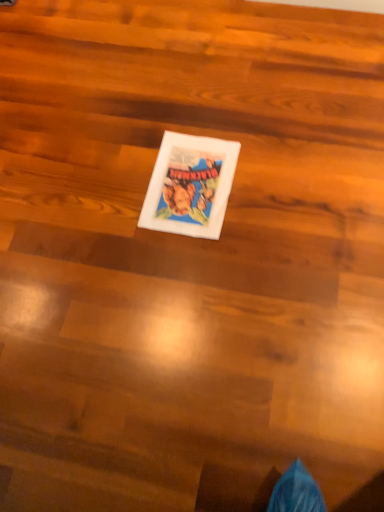
Describe the element at coordinates (190, 185) in the screenshot. I see `white matte comic book at center` at that location.

At what (x,y) coordinates should I click in order to perform the action: click on white matte comic book at center. Please return your answer as a coordinate pair (x, y). This screenshot has height=512, width=384. Looking at the image, I should click on (x=190, y=185).

In order to click on white matte comic book at center in this screenshot , I will do `click(190, 185)`.